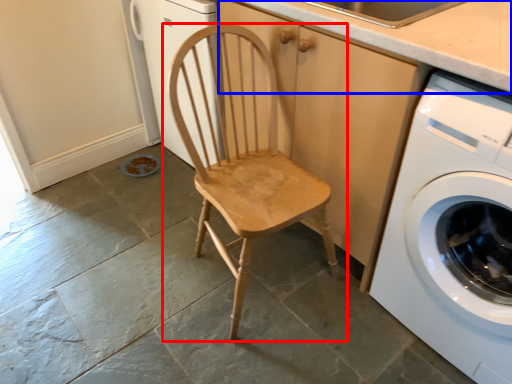
Question: Which object is closer to the camera taking this photo, chair (highlighted by a red box) or counter top (highlighted by a blue box)?

Choices:
 (A) chair
 (B) counter top

Answer: (A)